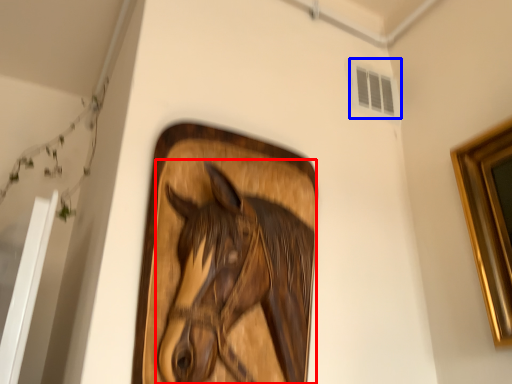
Question: Which object appears closest to the camera in this image, horse (highlighted by a red box) or window (highlighted by a blue box)?

Choices:
 (A) horse
 (B) window

Answer: (A)